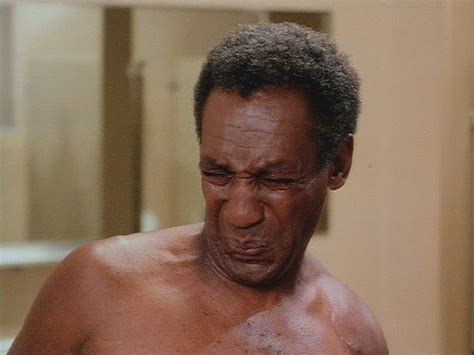
The width and height of the screenshot is (474, 355). I want to click on mirror, so click(x=89, y=128).